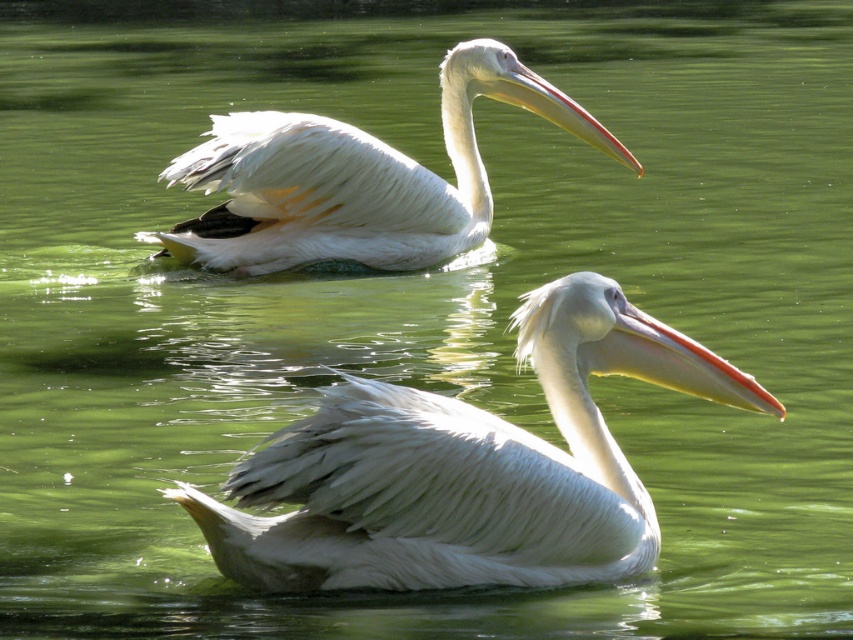
You are observing two pelicans in the water. Which of the two beaks, the matte white beak at upper center or the white matte beak at center, is positioned higher in the image?

The matte white beak at upper center is positioned higher than the white matte beak at center in the image.

You are observing two white feathered pelicans in the water. Which one, the white feathered pelican at center or the white feathered pelican at upper center, is positioned closer to you?

The white feathered pelican at center is closer to the viewer than the white feathered pelican at upper center.